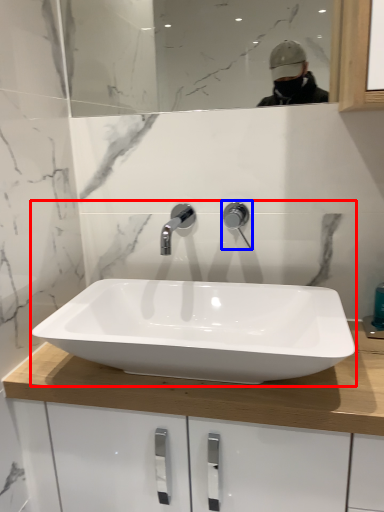
Question: Among these objects, which one is nearest to the camera, sink (highlighted by a red box) or tap (highlighted by a blue box)?

Choices:
 (A) sink
 (B) tap

Answer: (A)